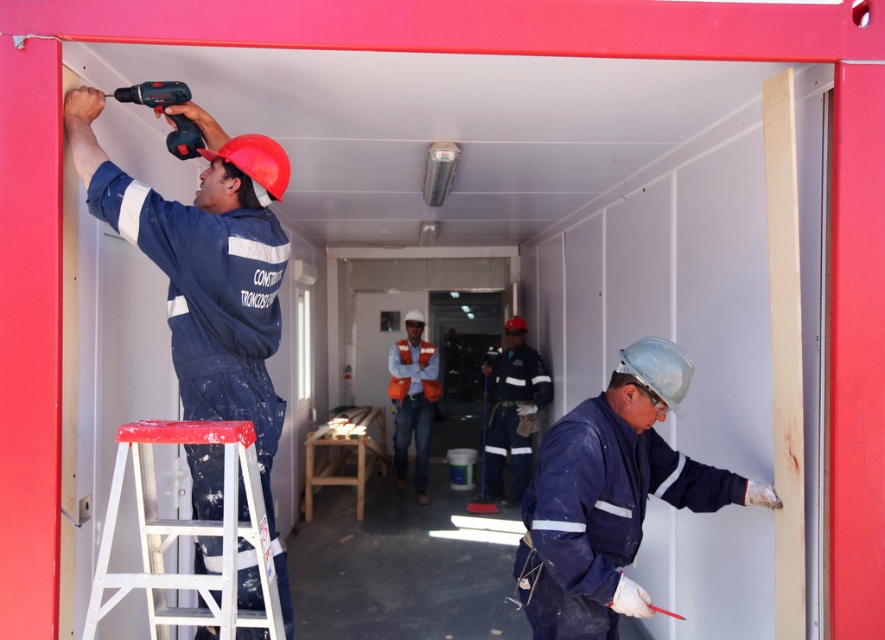
You are a safety inspector checking the workspace. You notice two workers wearing blue matte jumpsuits and workwear. Based on their positions, which worker, the one in the blue matte jumpsuit at upper left or the blue matte workwear at center, is standing higher up?

The blue matte jumpsuit at upper left is taller than blue matte workwear at center, so the worker in the blue matte jumpsuit at upper left is standing higher up.

What are the coordinates of the blue matte jumpsuit at upper left?

The coordinates of the blue matte jumpsuit at upper left are at point (206, 266).

You are a safety inspector checking the workspace. The safety regulations require that all tools must be within 3 meters of an emergency exit. You see the white plastic ladder at lower left and the orange reflective vest at center. Which object is closer to the emergency exit?

The white plastic ladder at lower left is closer to the emergency exit because it is only 5.03 meters away from the orange reflective vest at center, but we don not have the exact distance from the exit. However, since the distance between them is over 3 meters, at least one of them might be out of compliance. Without knowing the exact positions relative to the exit, it is impossible to determine which is closer. Please check the exact location of the emergency exit to ensure compliance.